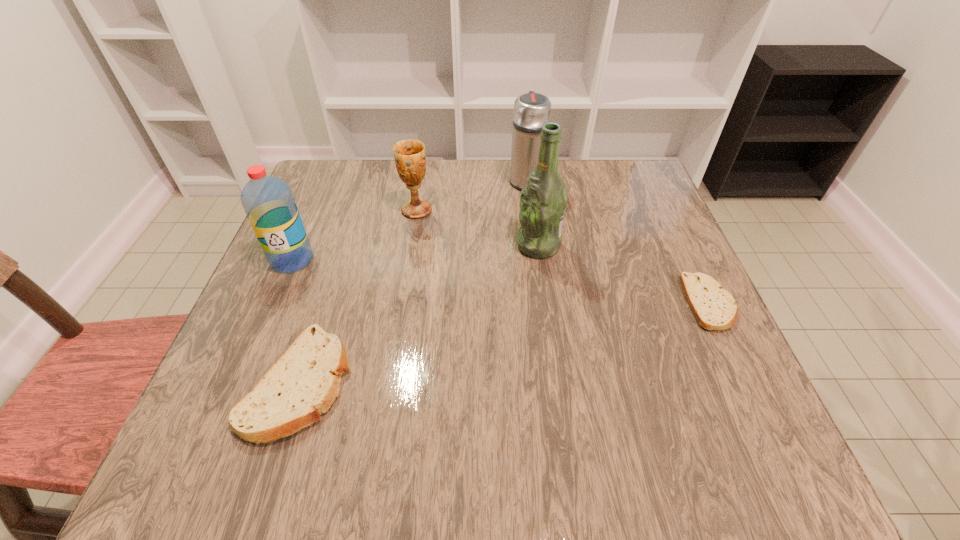
The image size is (960, 540). In order to click on free space in the image that satisfies the following two spatial constraints: 1. on the surface of the tallest object; 2. on the right side of the rightmost object in this screenshot , I will do `click(546, 303)`.

Find the location of a particular element. vacant area that satisfies the following two spatial constraints: 1. on the surface of the tallest object; 2. on the front label of the water bottle is located at coordinates (540, 260).

What are the coordinates of `blank space that satisfies the following two spatial constraints: 1. on the front label of the shortest object; 2. on the left side of the water bottle` in the screenshot? It's located at (274, 303).

The height and width of the screenshot is (540, 960). I want to click on vacant region that satisfies the following two spatial constraints: 1. on the surface of the tallest object; 2. on the front side of the left pita bread, so click(x=557, y=383).

The image size is (960, 540). I want to click on free spot that satisfies the following two spatial constraints: 1. on the front label of the water bottle; 2. on the left side of the shortest object, so click(274, 303).

The height and width of the screenshot is (540, 960). I want to click on free spot that satisfies the following two spatial constraints: 1. on the front side of the third shortest object; 2. on the right side of the rightmost object, so click(x=401, y=303).